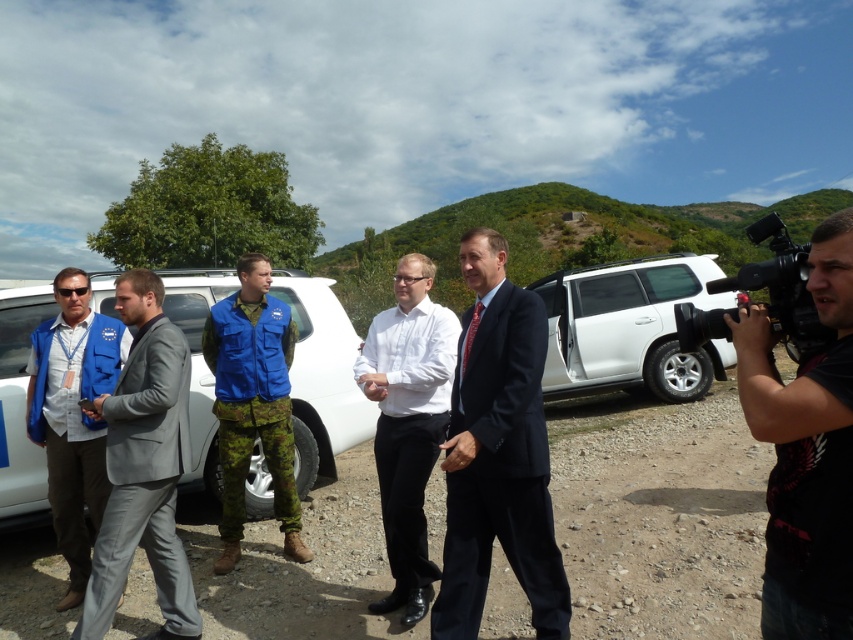
You are planning to take a photo of the dark blue suit at center and the white matte van at center. Which one will appear smaller in the photo?

The dark blue suit at center will appear smaller in the photo because it has a smaller size compared to the white matte van at center.

You are a photographer planning to take a group photo of the dark blue suit at center and the white matte van at center. Since the van is parked on the gravel, will you need to adjust the camera angle to include both subjects in the frame?

The dark blue suit at center is below the white matte van at center, so you will need to angle the camera upwards to include both subjects in the frame.

You are a photographer trying to capture a group photo of the five men in the scene. You have a black fabric camera at right and a white matte suv at right in your frame. Which object should you adjust your camera angle to avoid blocking the men, considering their heights?

The black fabric camera at right is shorter than the white matte suv at right, so you should adjust your camera angle to avoid the white matte suv at right since it is taller and more likely to block the view of the men.